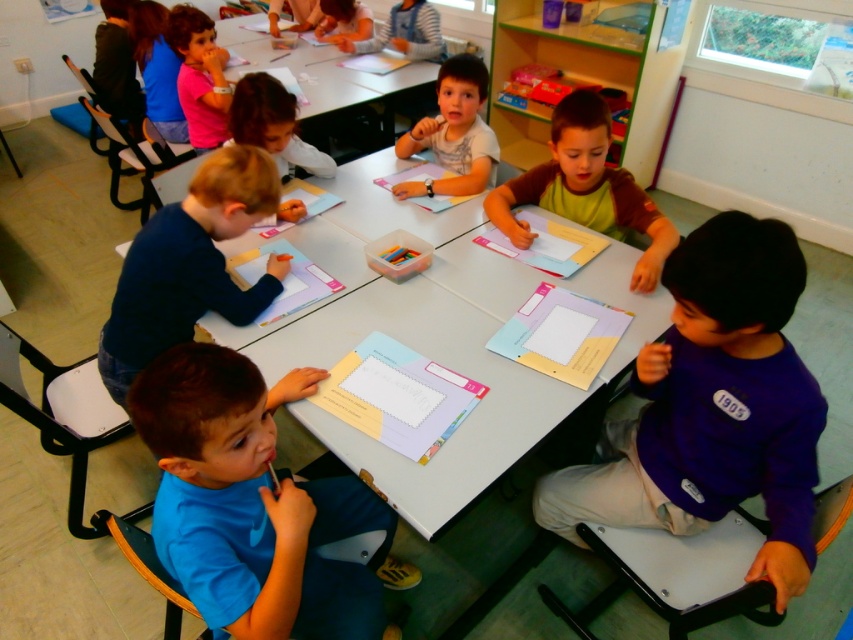
You are a teacher in the classroom looking at the students. Which student is wearing the purple matte shirt at lower right located below the smooth pink shirt at center?

The purple matte shirt at lower right is positioned under the smooth pink shirt at center, so the student wearing the purple matte shirt at lower right is located below the smooth pink shirt at center.

You are a teacher observing the classroom scene. You notice the green fabric shirt at center and the white plastic table at upper center. Which object takes up more horizontal space in the image?

The white plastic table at upper center takes up more horizontal space than the green fabric shirt at center because the green fabric shirt at center has a lesser width compared to white plastic table at upper center.

You are standing at the center of the classroom facing the window. Where is the purple matte shirt at lower right located relative to you?

The purple matte shirt at lower right is located at the lower right of the classroom from your perspective.